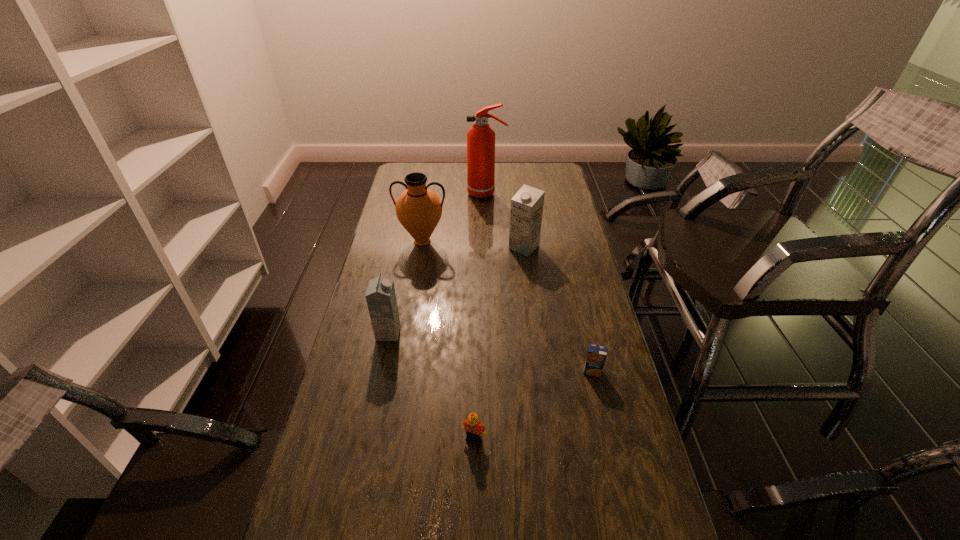
Locate an element on the screen. free space located 0.300m at the nozzle of the tallest object is located at coordinates (403, 193).

Identify the location of free spot located 0.330m at the nozzle of the tallest object. The image size is (960, 540). (396, 193).

This screenshot has width=960, height=540. What are the coordinates of `vacant space situated on the left of the pitcher` in the screenshot? It's located at (376, 241).

Locate an element on the screen. Image resolution: width=960 pixels, height=540 pixels. free location located on the back of the farther carton is located at coordinates (521, 223).

The width and height of the screenshot is (960, 540). I want to click on vacant space located 0.390m on the front label of the fourth farthest object, so click(522, 333).

Identify the location of free space located 0.140m on the front-facing side of the Lego. This screenshot has width=960, height=540. (473, 502).

You are a GUI agent. You are given a task and a screenshot of the screen. Output one action in this format:
    pyautogui.click(x=<x>, y=<y>)
    Task: Click on the free point located 0.130m on the front of the rightmost object
    The image size is (960, 540).
    Given the screenshot: What is the action you would take?
    pyautogui.click(x=603, y=418)

Image resolution: width=960 pixels, height=540 pixels. What are the coordinates of `pitcher at the left edge` in the screenshot? It's located at [x=418, y=208].

What are the coordinates of `carton that is at the left edge` in the screenshot? It's located at (381, 300).

Locate an element on the screen. object positioned at the right edge is located at coordinates (596, 356).